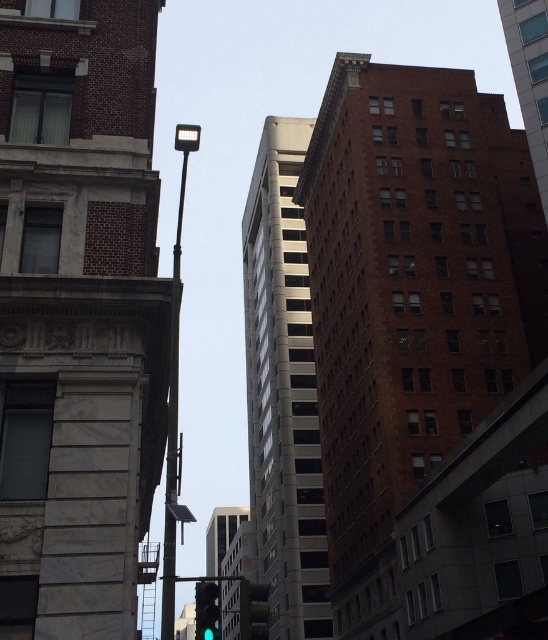
Question: Can you confirm if metallic gray pole at center-left is positioned to the right of green glass traffic light at center?

Choices:
 (A) yes
 (B) no

Answer: (B)

Question: Among these objects, which one is nearest to the camera?

Choices:
 (A) green matte traffic light at center
 (B) metallic gray pole at center-left
 (C) green glass traffic light at center

Answer: (A)

Question: Is green matte traffic light at center below green glass traffic light at center?

Choices:
 (A) no
 (B) yes

Answer: (A)

Question: Which point appears farthest from the camera in this image?

Choices:
 (A) (170, 310)
 (B) (254, 627)

Answer: (A)

Question: Considering the relative positions of metallic gray pole at center-left and green glass traffic light at center in the image provided, where is metallic gray pole at center-left located with respect to green glass traffic light at center?

Choices:
 (A) right
 (B) left

Answer: (B)

Question: Which of the following is the farthest from the observer?

Choices:
 (A) metallic gray pole at center-left
 (B) green glass traffic light at center
 (C) green matte traffic light at center

Answer: (A)